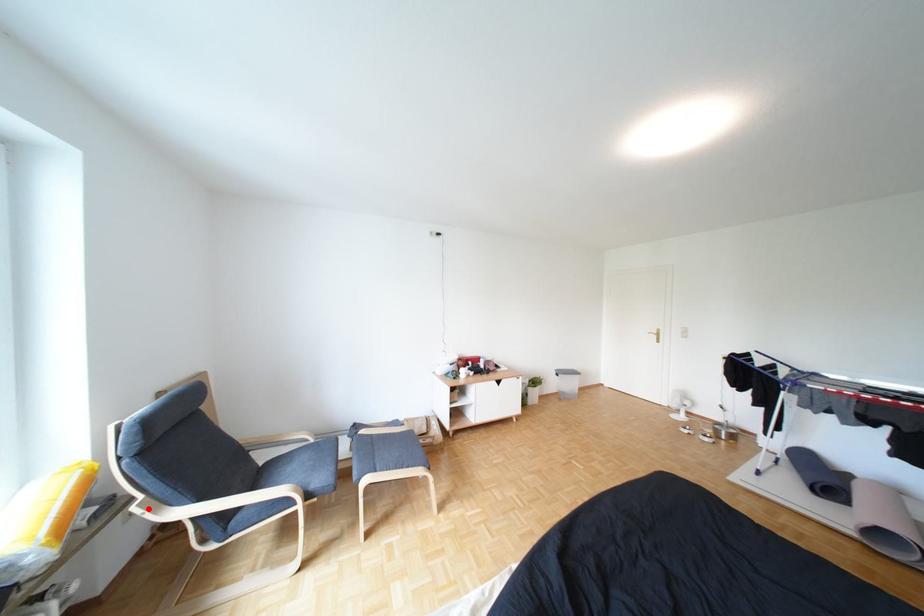
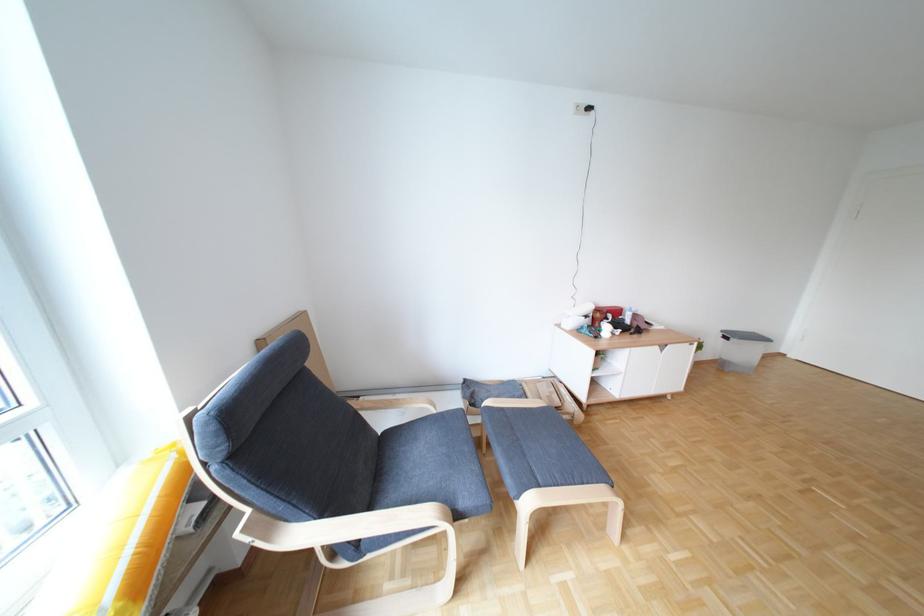
Find the pixel in the second image that matches the highlighted location in the first image.

(252, 535)